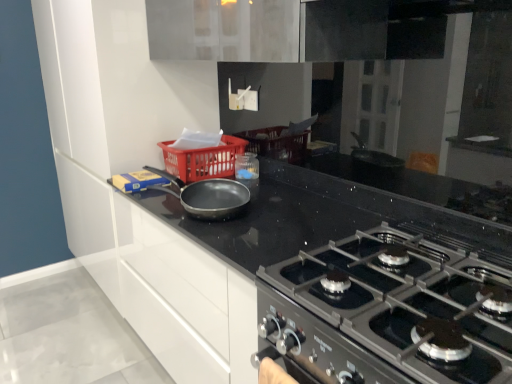
Question: Is matte black frying pan at center further to camera compared to black granite countertop at center?

Choices:
 (A) no
 (B) yes

Answer: (B)

Question: From a real-world perspective, is matte black frying pan at center located higher than black granite countertop at center?

Choices:
 (A) no
 (B) yes

Answer: (B)

Question: Could you tell me if matte black frying pan at center is facing black granite countertop at center?

Choices:
 (A) yes
 (B) no

Answer: (B)

Question: From a real-world perspective, is matte black frying pan at center physically below black granite countertop at center?

Choices:
 (A) yes
 (B) no

Answer: (B)

Question: Considering the relative positions of matte black frying pan at center and black granite countertop at center in the image provided, is matte black frying pan at center to the right of black granite countertop at center from the viewer's perspective?

Choices:
 (A) yes
 (B) no

Answer: (B)

Question: Considering their positions, is black matte gas stove at center located in front of or behind black granite countertop at center?

Choices:
 (A) behind
 (B) front

Answer: (B)

Question: From the image's perspective, relative to black granite countertop at center, is black matte gas stove at center above or below?

Choices:
 (A) below
 (B) above

Answer: (B)

Question: From their relative heights in the image, would you say black matte gas stove at center is taller or shorter than black granite countertop at center?

Choices:
 (A) short
 (B) tall

Answer: (A)

Question: Looking at their shapes, would you say black matte gas stove at center is wider or thinner than black granite countertop at center?

Choices:
 (A) wide
 (B) thin

Answer: (A)

Question: Looking at the image, does matte black frying pan at center seem bigger or smaller compared to plastic basket at center?

Choices:
 (A) small
 (B) big

Answer: (A)

Question: Would you say matte black frying pan at center is inside or outside plastic basket at center?

Choices:
 (A) outside
 (B) inside

Answer: (A)

Question: Considering the positions of matte black frying pan at center and plastic basket at center in the image, is matte black frying pan at center wider or thinner than plastic basket at center?

Choices:
 (A) thin
 (B) wide

Answer: (A)

Question: Does point (210, 180) appear closer or farther from the camera than point (202, 170)?

Choices:
 (A) closer
 (B) farther

Answer: (A)

Question: Is black granite countertop at center wider or thinner than black matte gas stove at center?

Choices:
 (A) thin
 (B) wide

Answer: (A)

Question: Would you say black granite countertop at center is to the left or to the right of black matte gas stove at center in the picture?

Choices:
 (A) right
 (B) left

Answer: (B)